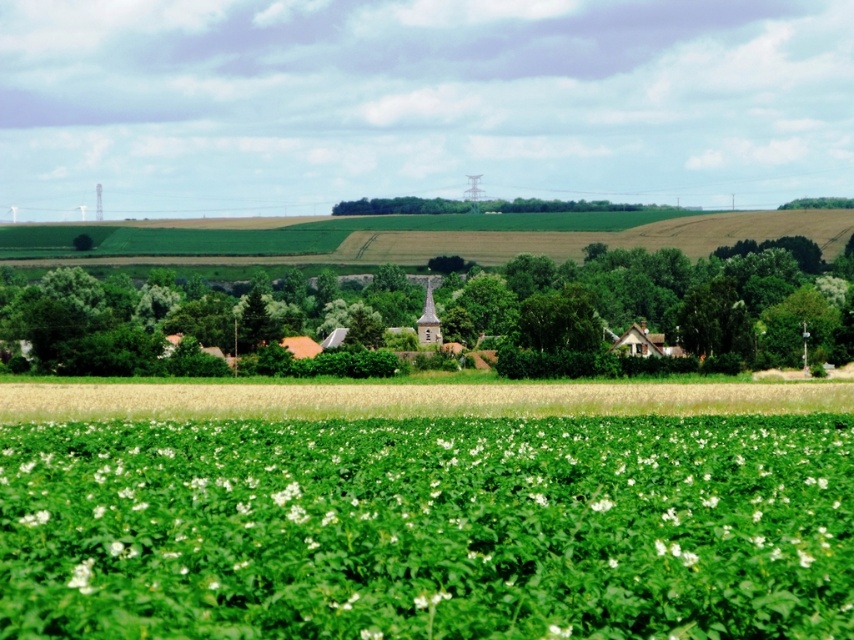
Question: Can you confirm if green leafy plant at center is thinner than green leafy tree at center?

Choices:
 (A) yes
 (B) no

Answer: (A)

Question: Is green leafy tree at center bigger than green grassy field at center?

Choices:
 (A) yes
 (B) no

Answer: (A)

Question: Which object is farther from the camera taking this photo?

Choices:
 (A) green leafy tree at center
 (B) green grassy field at center

Answer: (A)

Question: Is green leafy plant at center in front of green leafy tree at center?

Choices:
 (A) no
 (B) yes

Answer: (B)

Question: Estimate the real-world distances between objects in this image. Which object is closer to the green leafy tree at center?

Choices:
 (A) green leafy plant at center
 (B) green grassy field at center

Answer: (B)

Question: Which point is closer to the camera?

Choices:
 (A) (320, 400)
 (B) (782, 493)
 (C) (667, 312)

Answer: (B)